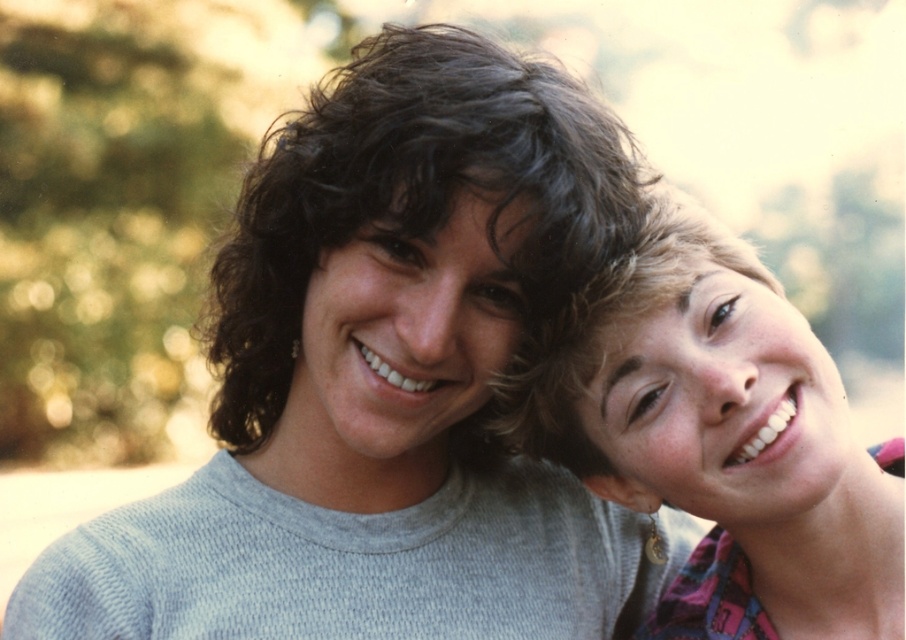
Does matte pink scarf at right come in front of blonde curly hair at upper right?

No.

Can you confirm if matte pink scarf at right is positioned to the left of blonde curly hair at upper right?

No, matte pink scarf at right is not to the left of blonde curly hair at upper right.

Which is behind, point (685, 397) or point (533, 374)?

The point (533, 374) is behind.

I want to click on matte pink scarf at right, so click(721, 438).

Can you confirm if matte pink scarf at right is positioned to the right of dark curly hair at center?

Yes, matte pink scarf at right is to the right of dark curly hair at center.

Is matte pink scarf at right shorter than dark curly hair at center?

Yes.

Is point (671, 257) less distant than point (536, 264)?

No, it is behind (536, 264).

The image size is (906, 640). What are the coordinates of `matte pink scarf at right` in the screenshot? It's located at 721,438.

Which is behind, point (637, 211) or point (558, 452)?

Point (558, 452)

Who is positioned more to the right, dark curly hair at center or blonde curly hair at upper right?

blonde curly hair at upper right

This screenshot has height=640, width=906. I want to click on dark curly hair at center, so click(x=418, y=209).